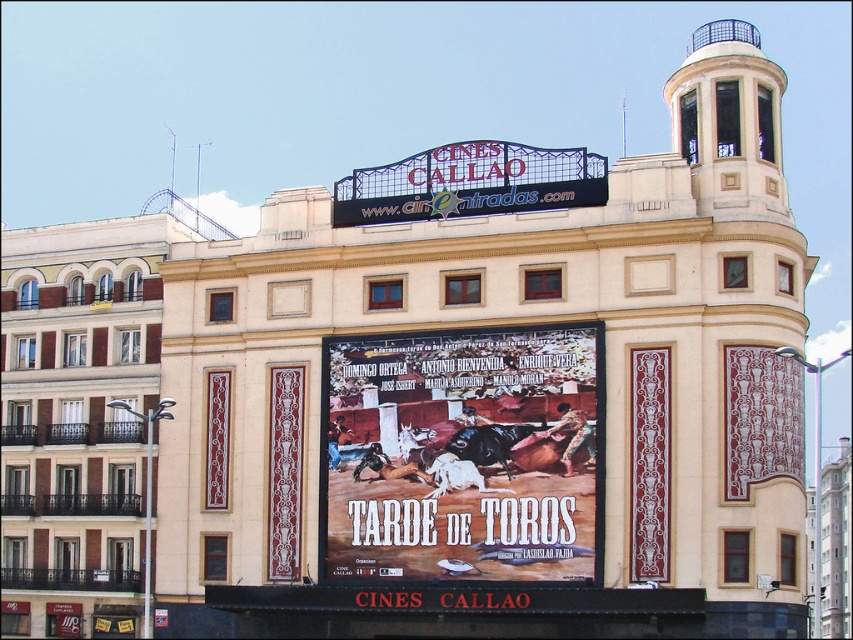
Question: Is matte poster at center behind metallic signboard at center?

Choices:
 (A) no
 (B) yes

Answer: (A)

Question: Which of the following is the farthest from the observer?

Choices:
 (A) (358, 410)
 (B) (445, 164)

Answer: (B)

Question: Among these objects, which one is farthest from the camera?

Choices:
 (A) metallic signboard at center
 (B) matte poster at center

Answer: (A)

Question: Observing the image, what is the correct spatial positioning of matte poster at center in reference to metallic signboard at center?

Choices:
 (A) left
 (B) right

Answer: (A)

Question: Can you confirm if matte poster at center is wider than metallic signboard at center?

Choices:
 (A) yes
 (B) no

Answer: (B)